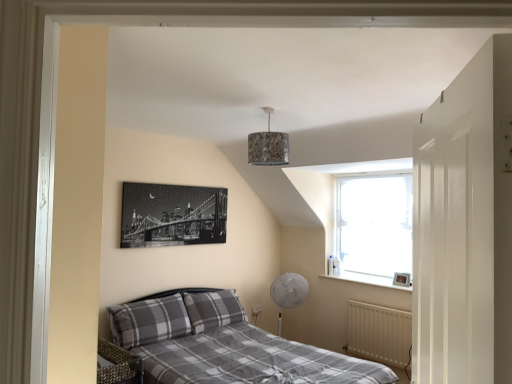
Find the location of `free spot above black and white canvas at upper left, the first picture frame from the top (from a real-world perspective)`. free spot above black and white canvas at upper left, the first picture frame from the top (from a real-world perspective) is located at coordinates (180, 183).